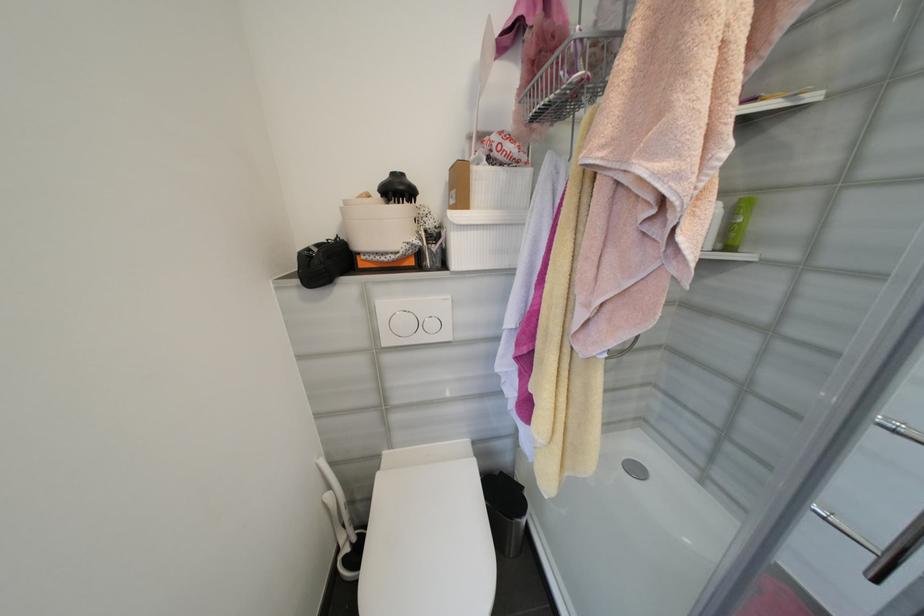
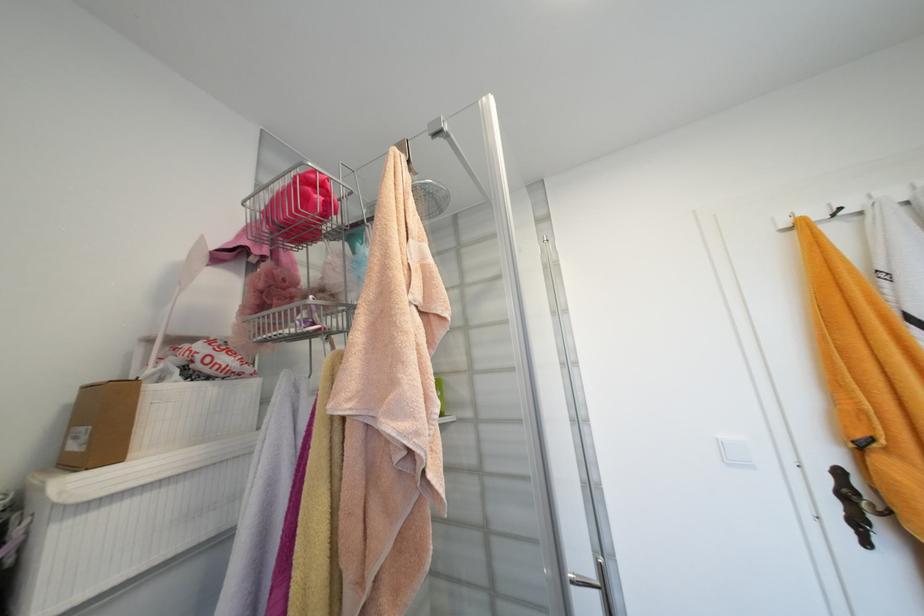
Locate, in the second image, the point that corresponds to point 512,169 in the first image.

(224, 383)